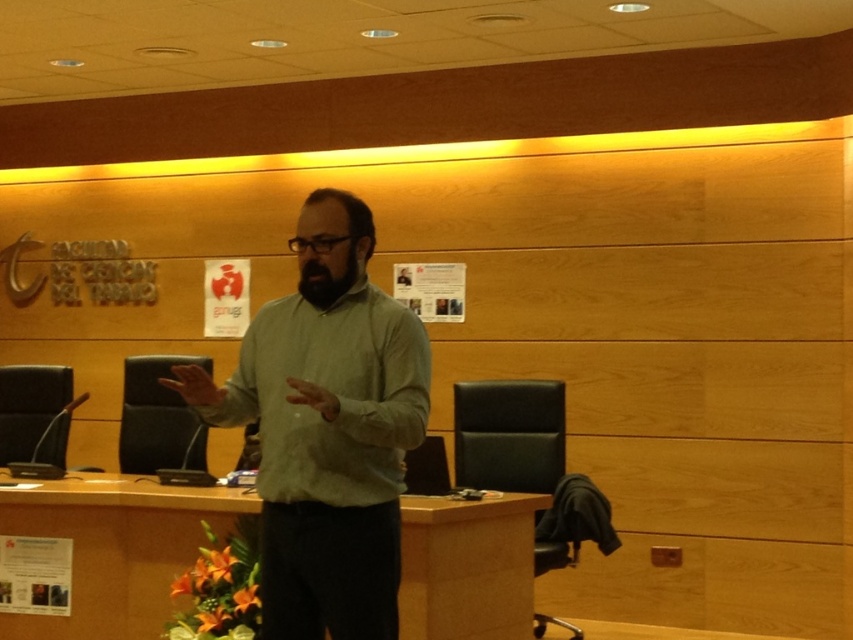
Can you confirm if green matte shirt at center is positioned below black fuzzy beard at center?

Correct, green matte shirt at center is located below black fuzzy beard at center.

Does green matte shirt at center have a lesser height compared to black fuzzy beard at center?

Incorrect, green matte shirt at center's height does not fall short of black fuzzy beard at center's.

Does point (396, 436) come in front of point (339, 285)?

Yes, it is in front of point (339, 285).

Identify the location of green matte shirt at center. (328, 435).

Between point (345, 627) and point (355, 355), which one is positioned behind?

The point (355, 355) is more distant.

The width and height of the screenshot is (853, 640). What do you see at coordinates (328, 435) in the screenshot? I see `green matte shirt at center` at bounding box center [328, 435].

This screenshot has height=640, width=853. I want to click on green matte shirt at center, so click(328, 435).

Locate an element on the screen. This screenshot has height=640, width=853. green matte shirt at center is located at coordinates (328, 435).

Is point (393, 410) less distant than point (350, 256)?

Yes, it is in front of point (350, 256).

Does point (369, 353) come in front of point (305, 269)?

Yes, it is.

In order to click on green matte dress shirt at center in this screenshot , I will do `click(334, 396)`.